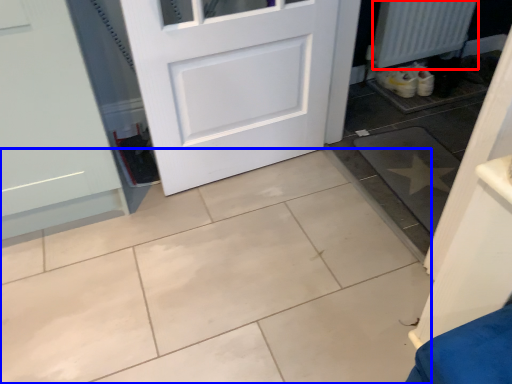
Question: Which object is further to the camera taking this photo, radiator (highlighted by a red box) or ceramic tile (highlighted by a blue box)?

Choices:
 (A) radiator
 (B) ceramic tile

Answer: (A)